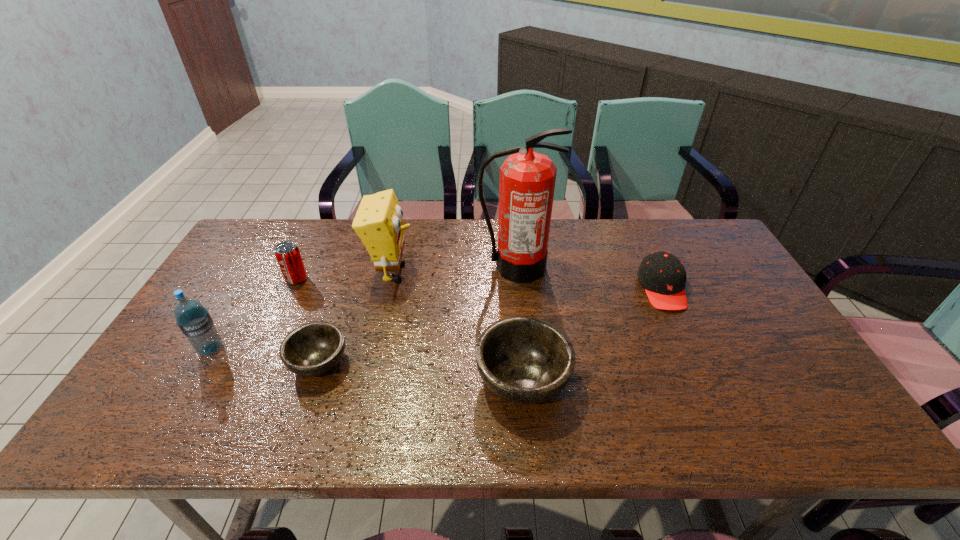
At what (x,y) coordinates should I click in order to perform the action: click on the shortest object. Please return your answer as a coordinate pair (x, y). Image resolution: width=960 pixels, height=540 pixels. Looking at the image, I should click on (312, 349).

The width and height of the screenshot is (960, 540). What are the coordinates of `the shorter bowl` in the screenshot? It's located at (312, 349).

Where is `the taller bowl`? the taller bowl is located at coordinates click(525, 360).

At what (x,y) coordinates should I click in order to perform the action: click on the sixth object from right to left. Please return your answer as a coordinate pair (x, y). Image resolution: width=960 pixels, height=540 pixels. Looking at the image, I should click on (288, 255).

I want to click on soda can, so pyautogui.click(x=288, y=255).

Where is `sponge`? This screenshot has width=960, height=540. sponge is located at coordinates (378, 222).

Identify the location of the rightmost object. This screenshot has height=540, width=960. (663, 276).

Identify the location of fire extinguisher. The width and height of the screenshot is (960, 540). (527, 179).

At what (x,y) coordinates should I click in order to perform the action: click on water bottle. Please return your answer as a coordinate pair (x, y). The image size is (960, 540). Looking at the image, I should click on (193, 319).

I want to click on the third tallest object, so click(x=193, y=319).